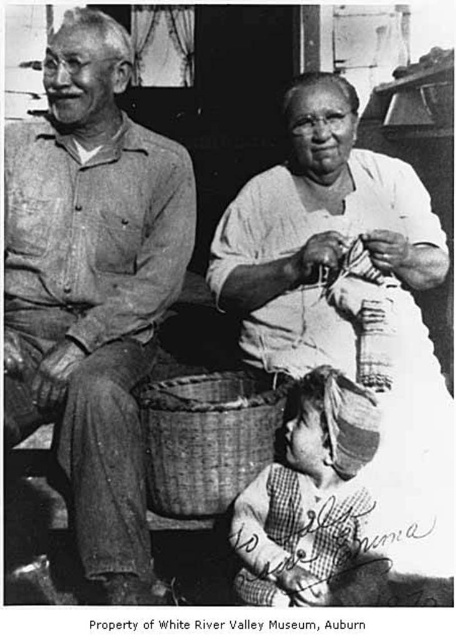
Does denim shirt at left have a greater height compared to plaid fabric dress at lower right?

Yes, denim shirt at left is taller than plaid fabric dress at lower right.

Can you confirm if denim shirt at left is positioned above plaid fabric dress at lower right?

Correct, denim shirt at left is located above plaid fabric dress at lower right.

Does point (45, 397) come behind point (316, 470)?

That is True.

At what (x,y) coordinates should I click in order to perform the action: click on denim shirt at left. Please return your answer as a coordinate pair (x, y). The height and width of the screenshot is (640, 456). Looking at the image, I should click on (92, 285).

Does denim shirt at left have a greater width compared to woven bamboo basket at lower center?

Yes, denim shirt at left is wider than woven bamboo basket at lower center.

Measure the distance between point [77,64] and camera.

2.36 meters

This screenshot has height=640, width=456. Find the location of `denim shirt at left`. denim shirt at left is located at coordinates (92, 285).

Who is positioned more to the right, plaid fabric dress at lower right or woven bamboo basket at lower center?

plaid fabric dress at lower right

Which is below, plaid fabric dress at lower right or woven bamboo basket at lower center?

plaid fabric dress at lower right

Find the location of a particular element. The image size is (456, 640). plaid fabric dress at lower right is located at coordinates (307, 496).